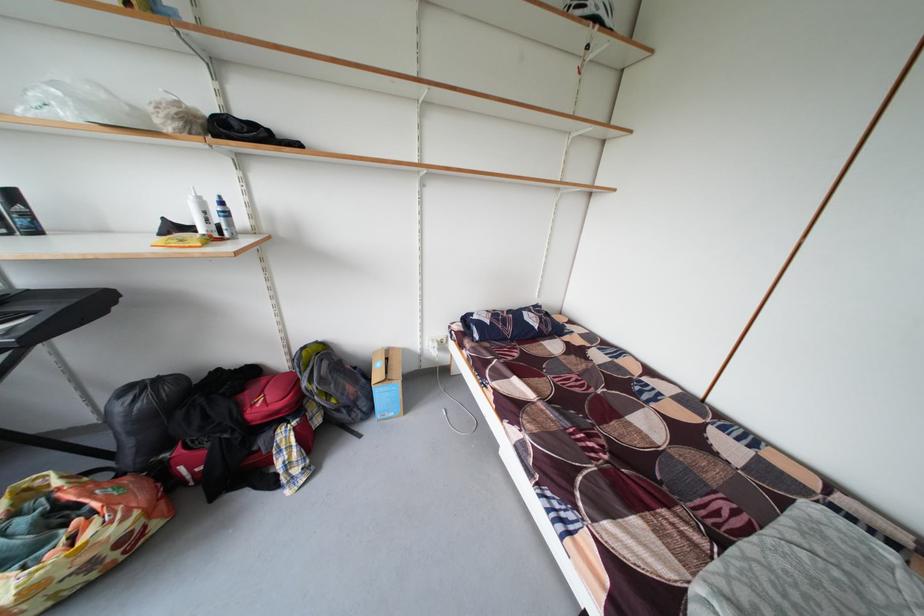
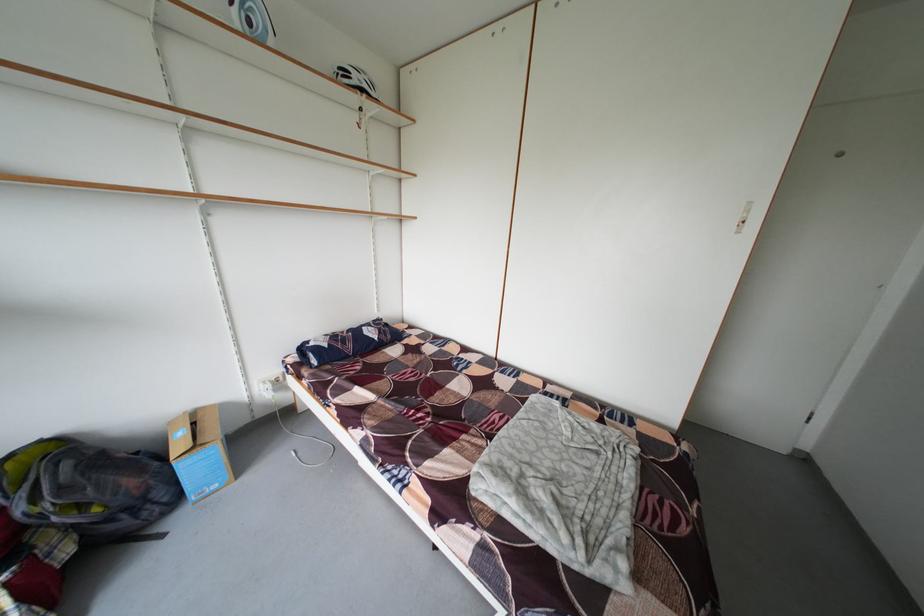
Where in the second image is the point corresponding to (436,344) from the first image?

(265, 387)